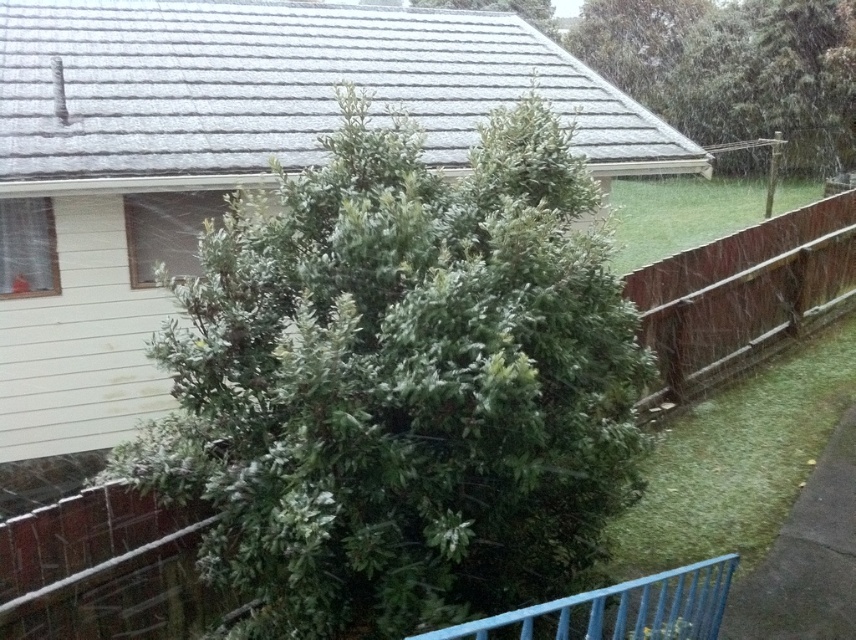
In the scene shown: Is green leafy tree at center further to camera compared to blue painted metal fence at lower center?

Yes, green leafy tree at center is further from the viewer.

Is green leafy tree at center smaller than blue painted metal fence at lower center?

Actually, green leafy tree at center might be larger than blue painted metal fence at lower center.

Between point (314, 388) and point (441, 637), which one is positioned behind?

Point (314, 388)

This screenshot has width=856, height=640. I want to click on green leafy tree at center, so click(401, 385).

Is brown wooden fence at right bigger than blue painted metal fence at lower center?

Indeed, brown wooden fence at right has a larger size compared to blue painted metal fence at lower center.

Between point (685, 252) and point (595, 632), which one is positioned behind?

The point (685, 252) is behind.

At what (x,y) coordinates should I click in order to perform the action: click on brown wooden fence at right. Please return your answer as a coordinate pair (x, y). Looking at the image, I should click on (742, 291).

What do you see at coordinates (734, 68) in the screenshot? Image resolution: width=856 pixels, height=640 pixels. I see `green leafy tree at upper center` at bounding box center [734, 68].

Who is more distant from viewer, [688,102] or [756,291]?

Point [688,102]

Locate an element on the screen. The height and width of the screenshot is (640, 856). green leafy tree at upper center is located at coordinates (734, 68).

Identify the location of green leafy tree at upper center. (734, 68).